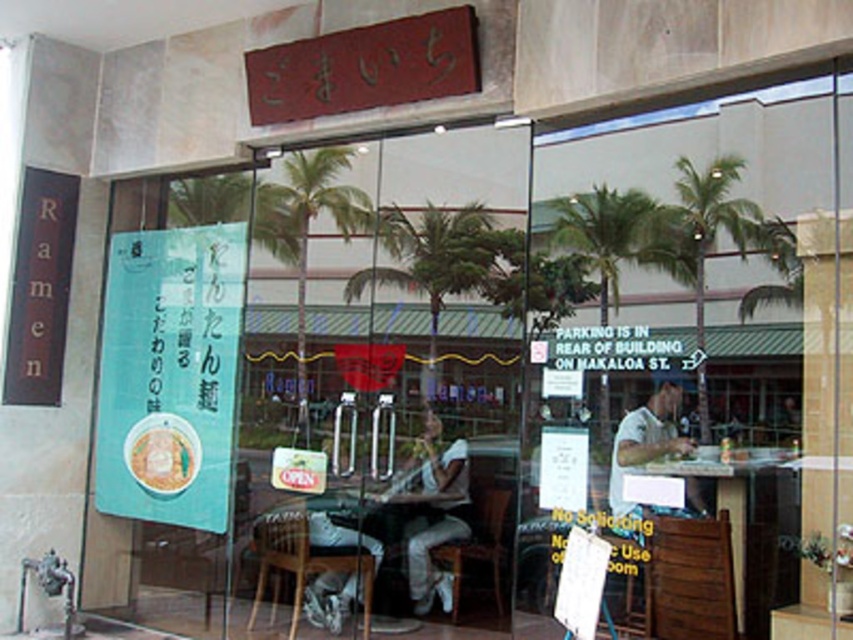
Question: Among these objects, which one is farthest from the camera?

Choices:
 (A) rattan chair at lower center
 (B) black wood sign at left
 (C) wooden chair at lower center

Answer: (C)

Question: Observing the image, what is the correct spatial positioning of wooden table at center in reference to wooden chair at lower center?

Choices:
 (A) right
 (B) left

Answer: (A)

Question: Which object is the farthest from the wooden table at center?

Choices:
 (A) wooden chair at lower center
 (B) black wood sign at left

Answer: (B)

Question: Can you confirm if wooden table at center is thinner than green leafy palm tree at center?

Choices:
 (A) yes
 (B) no

Answer: (B)

Question: Does black wood sign at left have a lesser width compared to green leafy palm tree at center?

Choices:
 (A) yes
 (B) no

Answer: (A)

Question: Among these objects, which one is nearest to the camera?

Choices:
 (A) wooden table at center
 (B) wooden chair at lower center
 (C) black wood sign at left

Answer: (A)